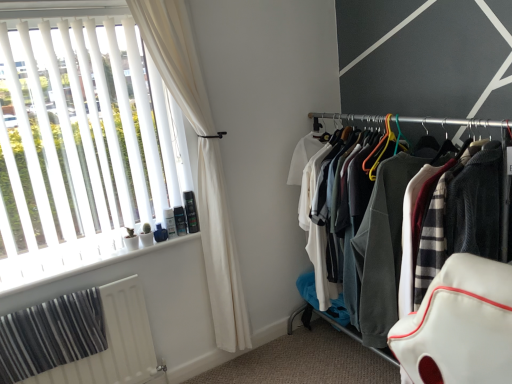
Question: Considering the positions of point (54, 208) and point (159, 244), is point (54, 208) closer or farther from the camera than point (159, 244)?

Choices:
 (A) farther
 (B) closer

Answer: (B)

Question: Considering the positions of white blinds at left and white plastic window sill at lower left in the image, is white blinds at left wider or thinner than white plastic window sill at lower left?

Choices:
 (A) thin
 (B) wide

Answer: (A)

Question: Which is farther from the white textured radiator at lower left?

Choices:
 (A) white fabric curtain at left
 (B) textured fabric clothes at right
 (C) white plastic window sill at lower left
 (D) white blinds at left

Answer: (B)

Question: Based on their relative distances, which object is farther from the textured fabric clothes at right?

Choices:
 (A) white textured radiator at lower left
 (B) white plastic window sill at lower left
 (C) white fabric curtain at left
 (D) white blinds at left

Answer: (D)